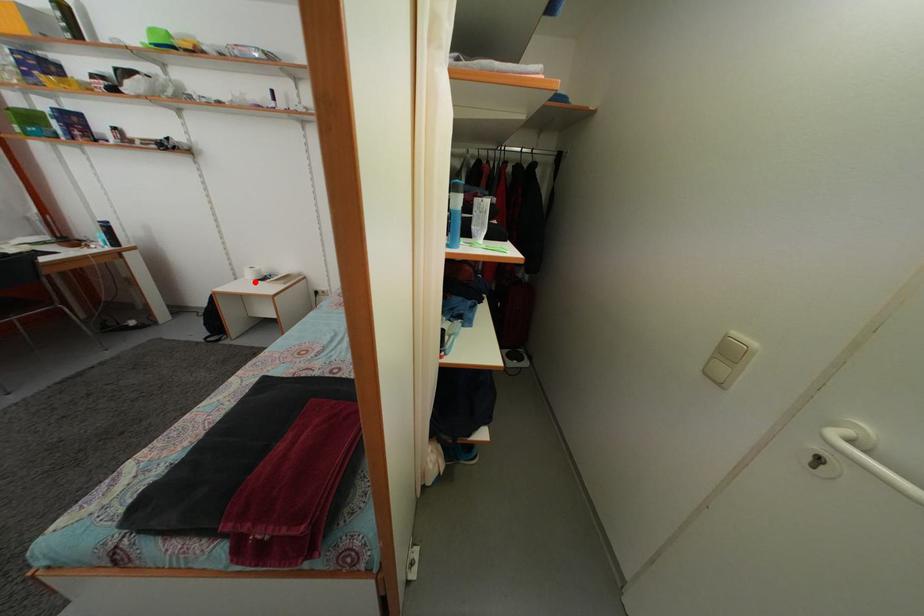
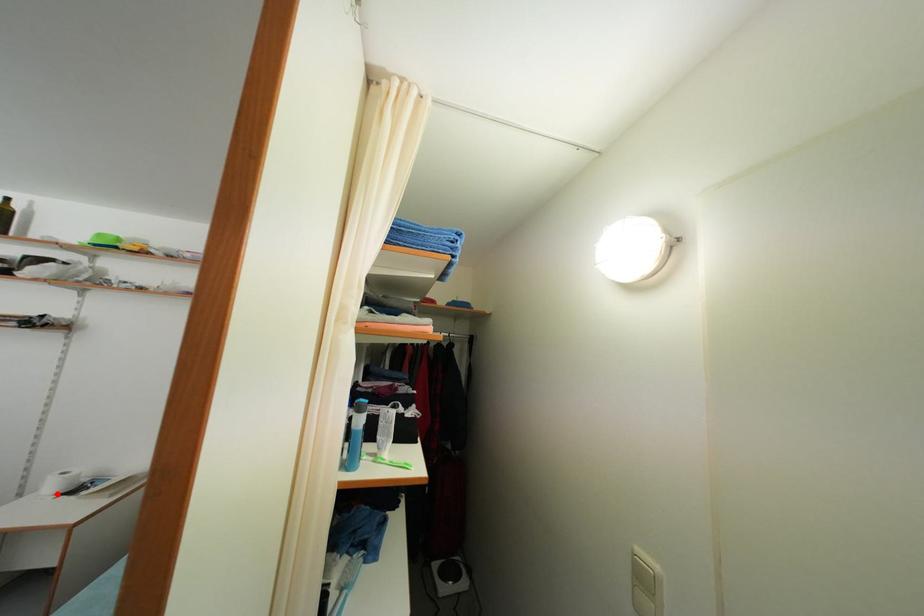
I am providing you with two images of the same scene from different viewpoints. A red point is marked on the first image and another point is marked on the second image. Are the points marked in image1 and image2 representing the same 3D position?

Yes